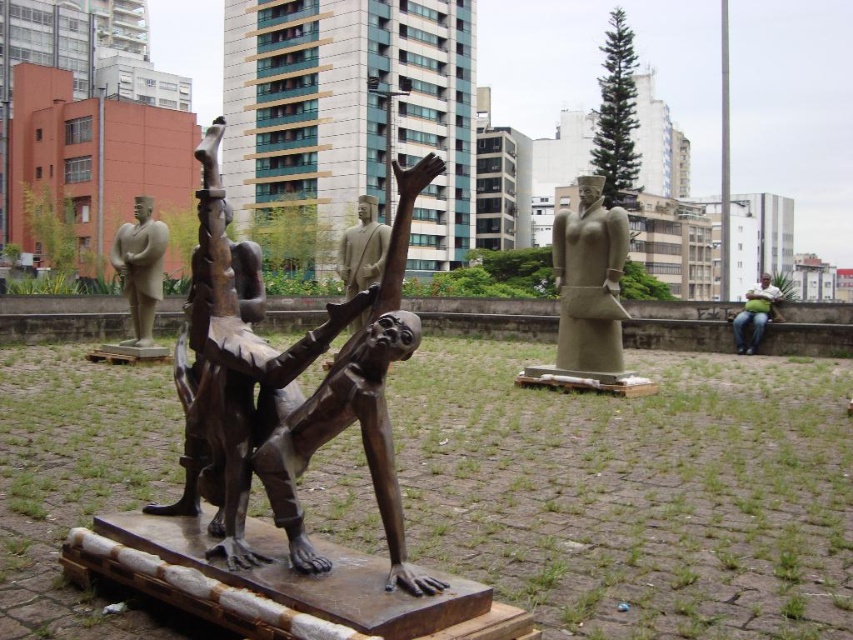
Question: Which object is farther from the camera taking this photo?

Choices:
 (A) gray stone statue at center
 (B) bronze sculpture at center
 (C) green fabric bag at right

Answer: (C)

Question: Can you confirm if matte bronze statue at upper left is bigger than green fabric bag at right?

Choices:
 (A) yes
 (B) no

Answer: (B)

Question: Does bronze sculpture at center lie in front of gray stone statue at center?

Choices:
 (A) yes
 (B) no

Answer: (A)

Question: Is bronze statue at center wider than green fabric bag at right?

Choices:
 (A) no
 (B) yes

Answer: (A)

Question: Which object is positioned farthest from the matte bronze statue at upper left?

Choices:
 (A) green fabric bag at right
 (B) bronze sculpture at center
 (C) bronze statue at center
 (D) gray stone statue at center

Answer: (A)

Question: Estimate the real-world distances between objects in this image. Which object is farther from the gray stone statue at center?

Choices:
 (A) matte bronze statue at upper left
 (B) bronze statue at center
 (C) green fabric bag at right

Answer: (A)